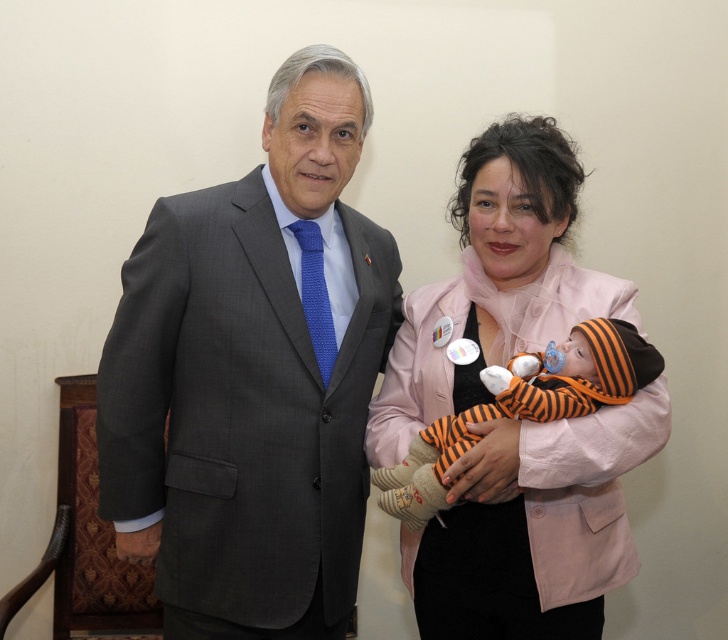
Question: In this image, where is matte gray suit at left located relative to blue knitted tie at center?

Choices:
 (A) below
 (B) above

Answer: (A)

Question: Does pink fabric baby at center appear under orange striped fabric baby at center?

Choices:
 (A) no
 (B) yes

Answer: (A)

Question: Does pink fabric baby at center have a smaller size compared to orange striped fabric baby at center?

Choices:
 (A) no
 (B) yes

Answer: (A)

Question: Considering the real-world distances, which object is farthest from the orange striped fabric baby at center?

Choices:
 (A) pink fabric baby at center
 (B) blue knitted tie at center

Answer: (B)

Question: Which point is farther to the camera?

Choices:
 (A) (582, 380)
 (B) (494, 563)
 (C) (317, 241)
 (D) (189, 296)

Answer: (C)

Question: Estimate the real-world distances between objects in this image. Which object is closer to the orange striped fabric baby at center?

Choices:
 (A) matte gray suit at left
 (B) blue knitted tie at center

Answer: (A)